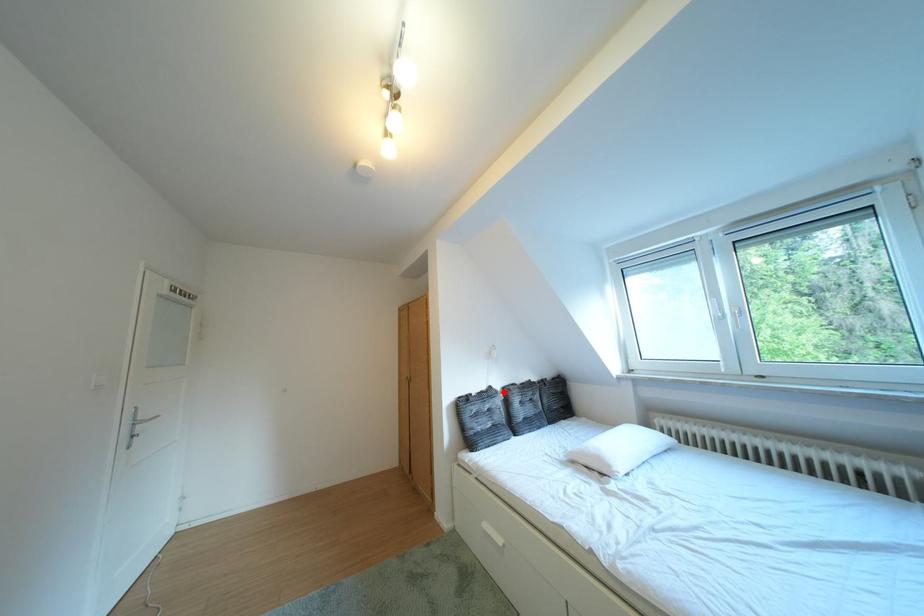
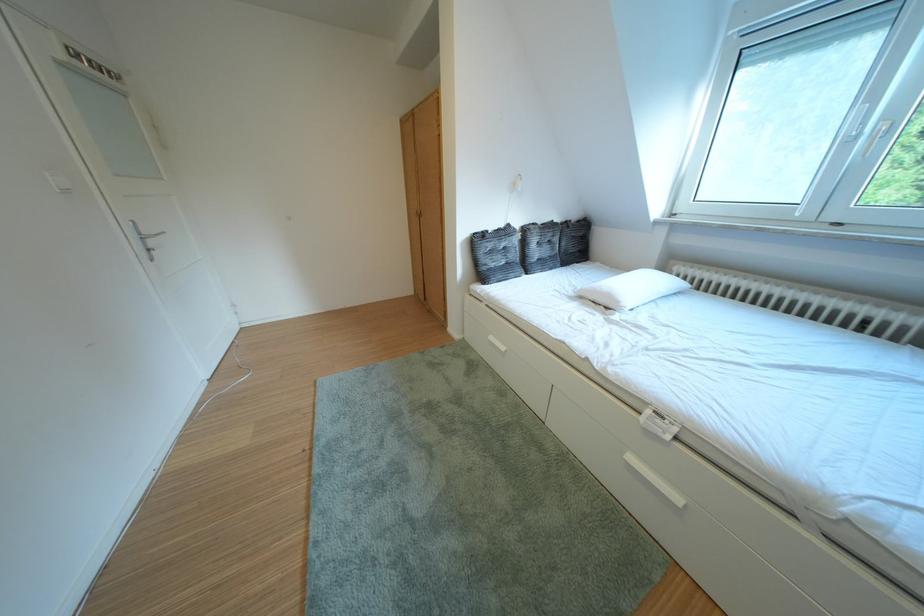
Where in the second image is the point corresponding to the highlighted location from the first image?

(523, 230)